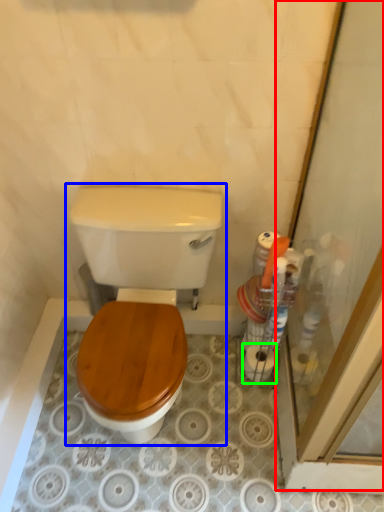
Question: Which is nearer to the screen door (highlighted by a red box)? toilet (highlighted by a blue box) or toilet paper (highlighted by a green box).

Choices:
 (A) toilet
 (B) toilet paper

Answer: (B)